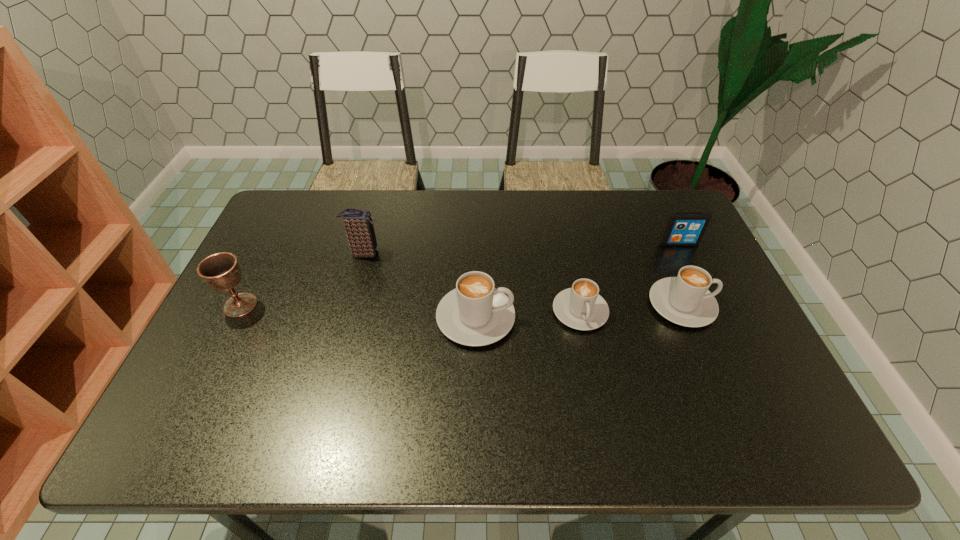
Image resolution: width=960 pixels, height=540 pixels. Find the location of `empty location between the leftmost object and the fifth object from right to left`. empty location between the leftmost object and the fifth object from right to left is located at coordinates (302, 279).

You are a GUI agent. You are given a task and a screenshot of the screen. Output one action in this format:
    pyautogui.click(x=<x>, y=<y>)
    Task: Click on the free spot between the leftmost object and the fourth object from left to right
    The image size is (960, 540).
    Given the screenshot: What is the action you would take?
    [x=410, y=308]

Where is `blank region between the fourth object from right to left and the shortest object`? blank region between the fourth object from right to left and the shortest object is located at coordinates (528, 314).

Where is `free space between the iPod and the shortest cappuccino`? Image resolution: width=960 pixels, height=540 pixels. free space between the iPod and the shortest cappuccino is located at coordinates (630, 277).

You are a GUI agent. You are given a task and a screenshot of the screen. Output one action in this format:
    pyautogui.click(x=<x>, y=<y>)
    Task: Click on the empty space between the farthest object and the chalice
    Image resolution: width=960 pixels, height=540 pixels.
    Given the screenshot: What is the action you would take?
    [460, 274]

Locate an element on the screen. This screenshot has height=540, width=960. vacant space in between the fifth nearest object and the leftmost cappuccino is located at coordinates (420, 286).

Where is `free spot between the second cappuccino from left to right and the iPod`? free spot between the second cappuccino from left to right and the iPod is located at coordinates (630, 277).

Locate an element on the screen. Image resolution: width=960 pixels, height=540 pixels. unoccupied area between the fourth object from right to left and the clutch bag is located at coordinates (420, 286).

I want to click on object that stands as the fourth closest to the rightmost cappuccino, so click(x=358, y=224).

Identify the location of object that stands as the closest to the second object from left to right. The image size is (960, 540). (475, 313).